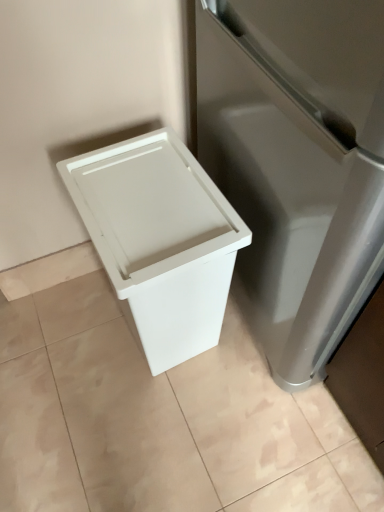
Question: Can you confirm if white plastic waste bin at lower left is thinner than white plastic trash can at lower left?

Choices:
 (A) yes
 (B) no

Answer: (A)

Question: Considering the relative positions of white plastic waste bin at lower left and white plastic trash can at lower left in the image provided, is white plastic waste bin at lower left to the right of white plastic trash can at lower left from the viewer's perspective?

Choices:
 (A) yes
 (B) no

Answer: (A)

Question: Is white plastic waste bin at lower left positioned behind white plastic trash can at lower left?

Choices:
 (A) no
 (B) yes

Answer: (A)

Question: Can you confirm if white plastic waste bin at lower left is positioned to the left of white plastic trash can at lower left?

Choices:
 (A) yes
 (B) no

Answer: (B)

Question: Does white plastic waste bin at lower left have a greater height compared to white plastic trash can at lower left?

Choices:
 (A) no
 (B) yes

Answer: (B)

Question: Is the depth of white plastic waste bin at lower left less than that of white plastic trash can at lower left?

Choices:
 (A) yes
 (B) no

Answer: (A)

Question: Is white plastic trash can at lower left in front of white plastic waste bin at lower left?

Choices:
 (A) yes
 (B) no

Answer: (B)

Question: From a real-world perspective, is white plastic trash can at lower left under white plastic waste bin at lower left?

Choices:
 (A) yes
 (B) no

Answer: (A)

Question: Considering the relative sizes of white plastic trash can at lower left and white plastic waste bin at lower left in the image provided, is white plastic trash can at lower left thinner than white plastic waste bin at lower left?

Choices:
 (A) no
 (B) yes

Answer: (A)

Question: Can we say white plastic trash can at lower left lies outside white plastic waste bin at lower left?

Choices:
 (A) yes
 (B) no

Answer: (A)

Question: Would you say white plastic trash can at lower left is a long distance from white plastic waste bin at lower left?

Choices:
 (A) no
 (B) yes

Answer: (A)

Question: Is white plastic trash can at lower left next to white plastic waste bin at lower left and touching it?

Choices:
 (A) no
 (B) yes

Answer: (A)

Question: Considering their positions, is white plastic trash can at lower left located in front of or behind white plastic waste bin at lower left?

Choices:
 (A) front
 (B) behind

Answer: (B)